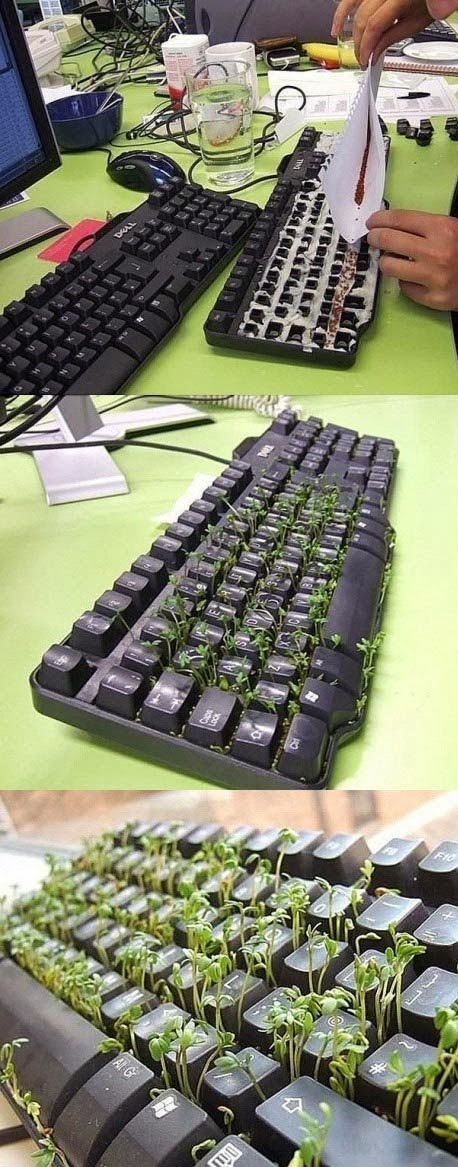
Where is `glass of water`? The image size is (458, 1167). glass of water is located at coordinates (226, 125).